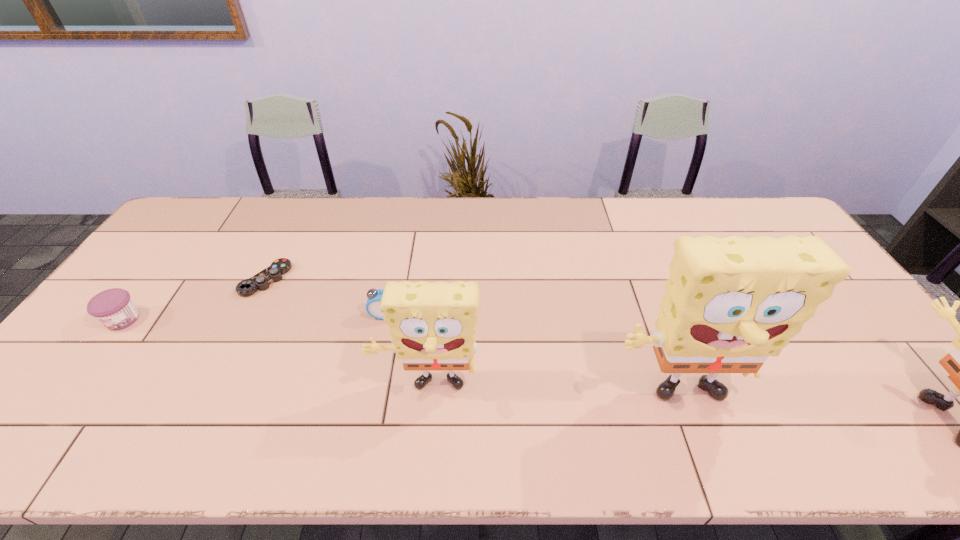
The width and height of the screenshot is (960, 540). Find the location of `the fourth shortest object`. the fourth shortest object is located at coordinates (433, 325).

Where is `the leftmost sponge`? The width and height of the screenshot is (960, 540). the leftmost sponge is located at coordinates (433, 325).

Identify the location of the fifth object from left to right. (730, 303).

Locate an element on the screen. The height and width of the screenshot is (540, 960). control is located at coordinates (273, 273).

The image size is (960, 540). What are the coordinates of `the second object from left to right` in the screenshot? It's located at (273, 273).

This screenshot has width=960, height=540. In order to click on the leftmost object in this screenshot , I will do `click(114, 308)`.

This screenshot has width=960, height=540. I want to click on jam, so click(114, 308).

You are a GUI agent. You are given a task and a screenshot of the screen. Output one action in this format:
    pyautogui.click(x=<x>, y=<y>)
    Task: Click on the third shortest object
    The width and height of the screenshot is (960, 540).
    Given the screenshot: What is the action you would take?
    pyautogui.click(x=374, y=296)

Locate an element on the screen. vacant position located on the back of the farthest object is located at coordinates (286, 239).

This screenshot has height=540, width=960. What are the coordinates of `vacant space situated 0.220m on the front label of the second shortest object` in the screenshot? It's located at (57, 408).